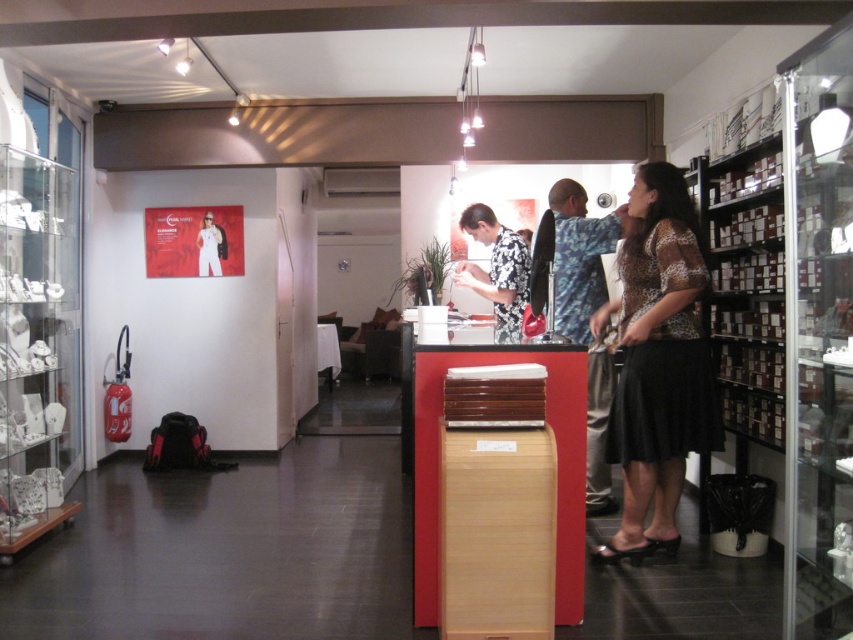
You are a customer in the store and want to know if the leopard print blouse at center and the black floral shirt at center are close enough to touch each other without moving. Can you determine this based on their distance?

The leopard print blouse at center is 31.65 inches away from the black floral shirt at center. Since 31.65 inches is roughly 2.64 feet, they are not close enough to touch each other without moving.

You are a customer in the store and want to see both the leopard print blouse at center and the black floral shirt at center. Which one is taller?

The leopard print blouse at center is much taller than the black floral shirt at center.

You are a store employee who needs to hang a large promotional banner between the leopard print blouse at center and the black floral shirt at center. Since the banner requires 2 meters of space, will there be enough room between them?

The leopard print blouse at center occupies less space than the black floral shirt at center, but the exact distance between them isn not specified in the provided information. Therefore, it is uncertain if there is sufficient space for the 2 meter banner.